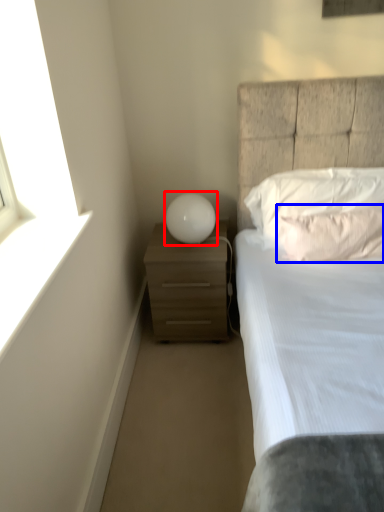
Question: Which point is further to the camera, table lamp (highlighted by a red box) or pillow (highlighted by a blue box)?

Choices:
 (A) table lamp
 (B) pillow

Answer: (A)